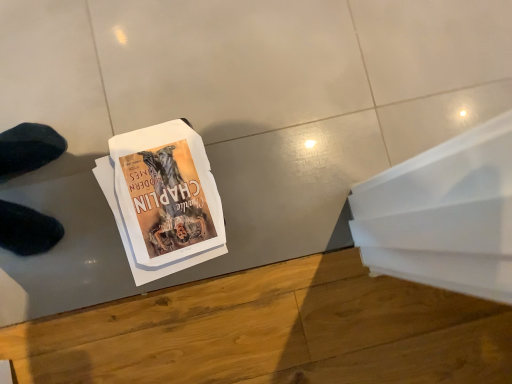
The width and height of the screenshot is (512, 384). Find the location of `vacant area that is in front of matte paper book at center`. vacant area that is in front of matte paper book at center is located at coordinates point(80,277).